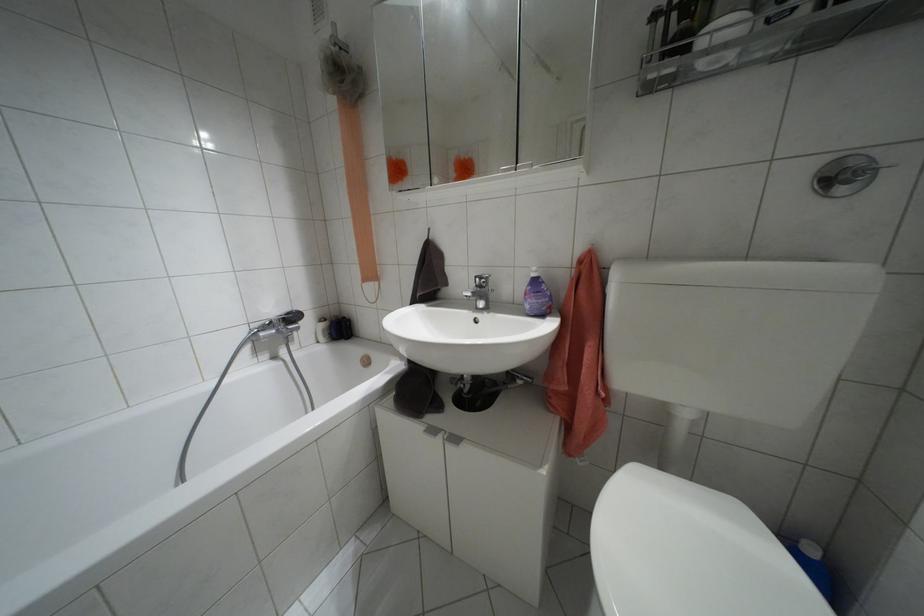
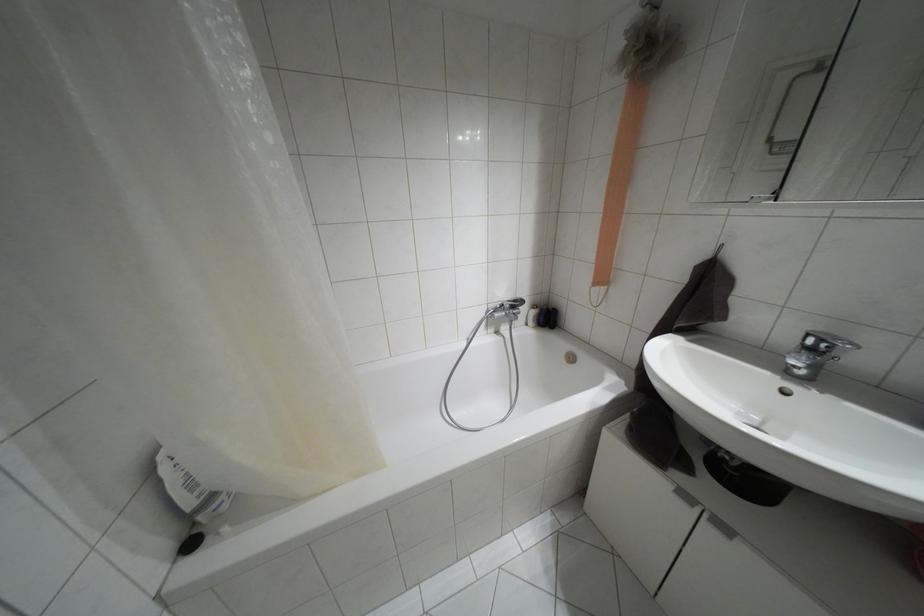
The point at (475, 277) is marked in the first image. Where is the corresponding point in the second image?

(808, 334)